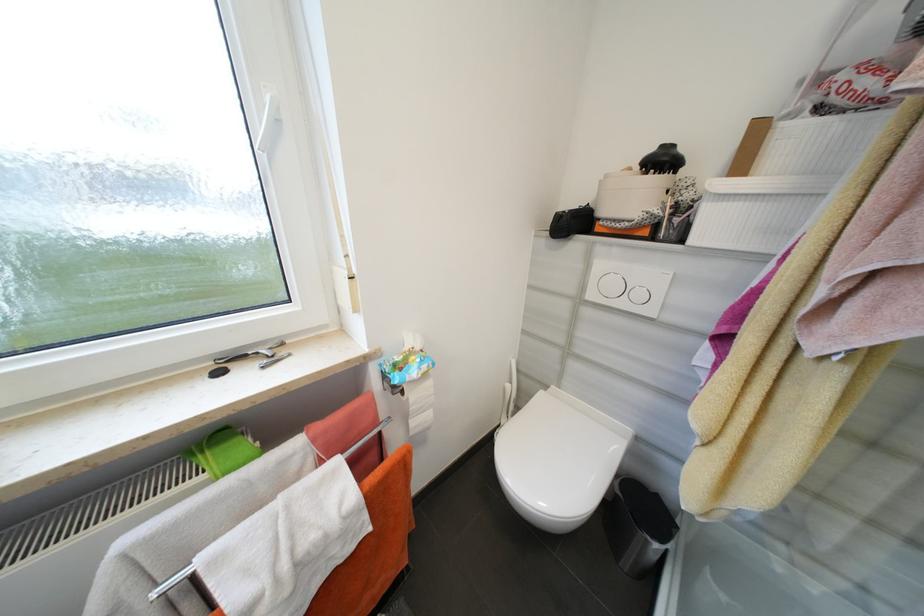
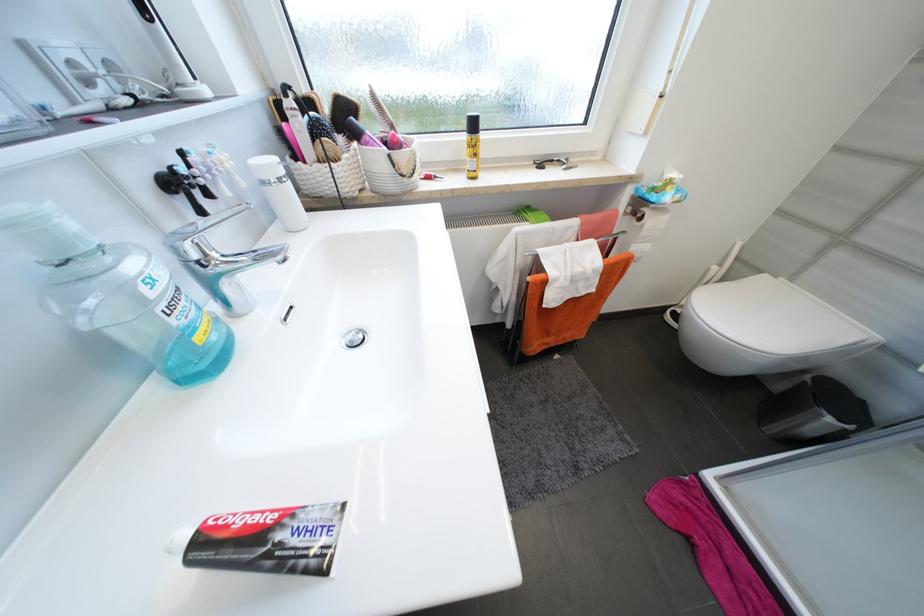
Locate, in the second image, the point that corresponds to (x=251, y=357) in the first image.

(558, 161)